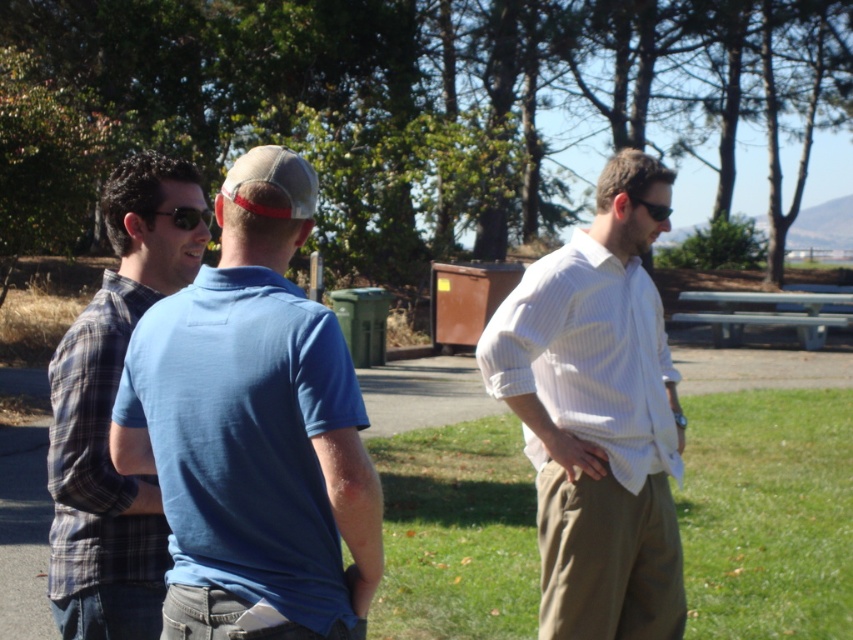
You are planning to set up a small tent for a picnic in the park. Given the presence of the green grass at right and the plaid cotton shirt at left, which location would be more suitable for placing the tent based on the available space?

The green grass at right has a larger size compared to the plaid cotton shirt at left, so the green grass at right would be more suitable for placing the tent due to its greater space availability.

You are planning to set up a small tent in the park. Given the presence of the green grass at right and the white striped shirt at right, which location would be more suitable for the tent based on their sizes?

The green grass at right is bigger than the white striped shirt at right, so the green grass at right would be more suitable for setting up the tent as it provides a larger space.